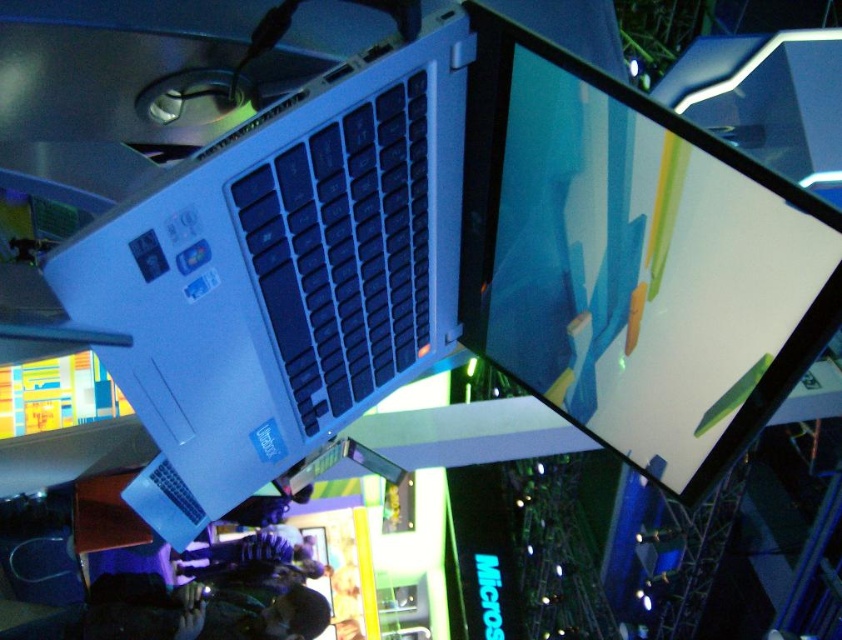
Question: Where is satin white laptop at upper center located in relation to matte black screen at upper center in the image?

Choices:
 (A) right
 (B) left

Answer: (B)

Question: Does satin white laptop at upper center have a smaller size compared to matte black screen at upper center?

Choices:
 (A) no
 (B) yes

Answer: (A)

Question: Among these points, which one is nearest to the camera?

Choices:
 (A) (726, 193)
 (B) (429, 189)

Answer: (A)

Question: Is satin white laptop at upper center closer to the viewer compared to matte black screen at upper center?

Choices:
 (A) no
 (B) yes

Answer: (A)